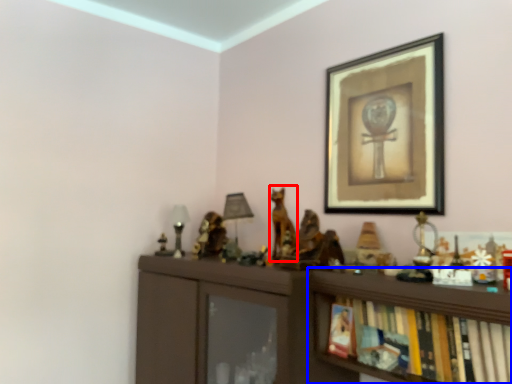
Question: Which point is further to the camera, animal (highlighted by a red box) or shelf (highlighted by a blue box)?

Choices:
 (A) animal
 (B) shelf

Answer: (A)